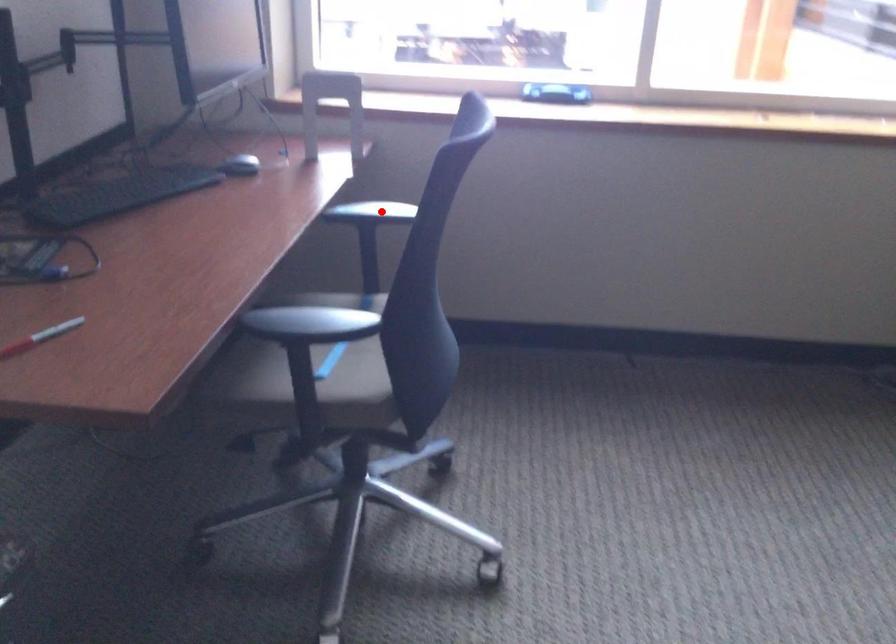
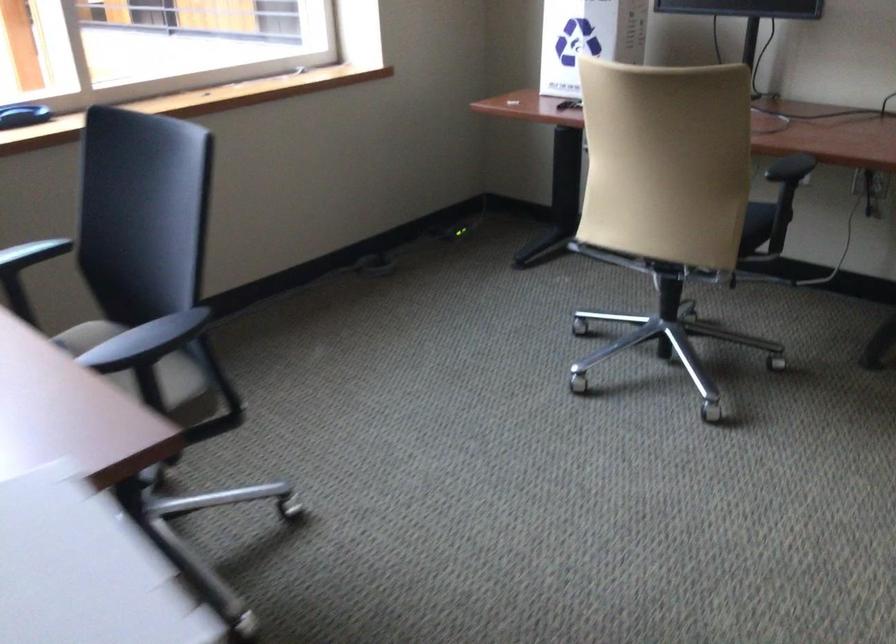
The point at the highlighted location is marked in the first image. Where is the corresponding point in the second image?

(31, 254)